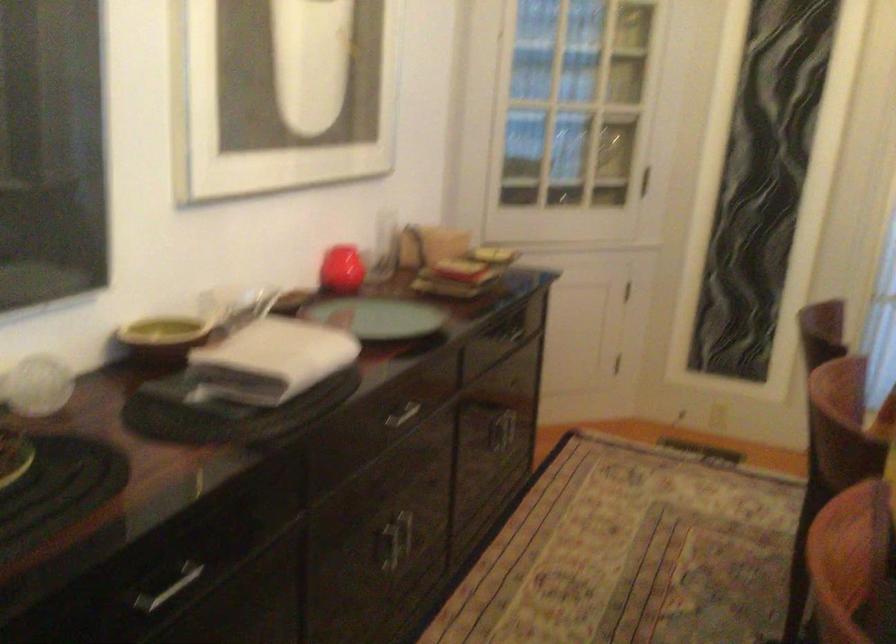
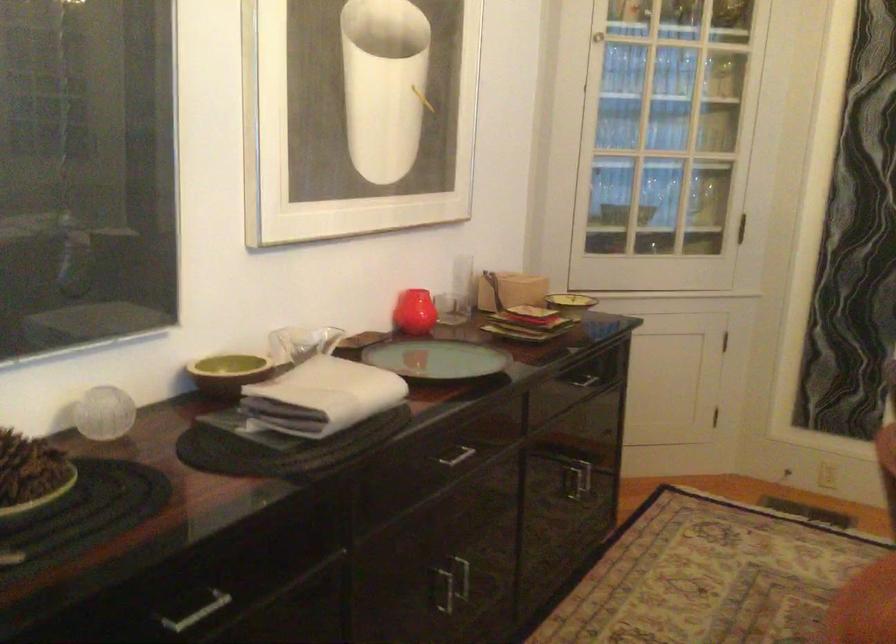
Find the pixel in the second image that matches (402,413) in the first image.

(453, 455)